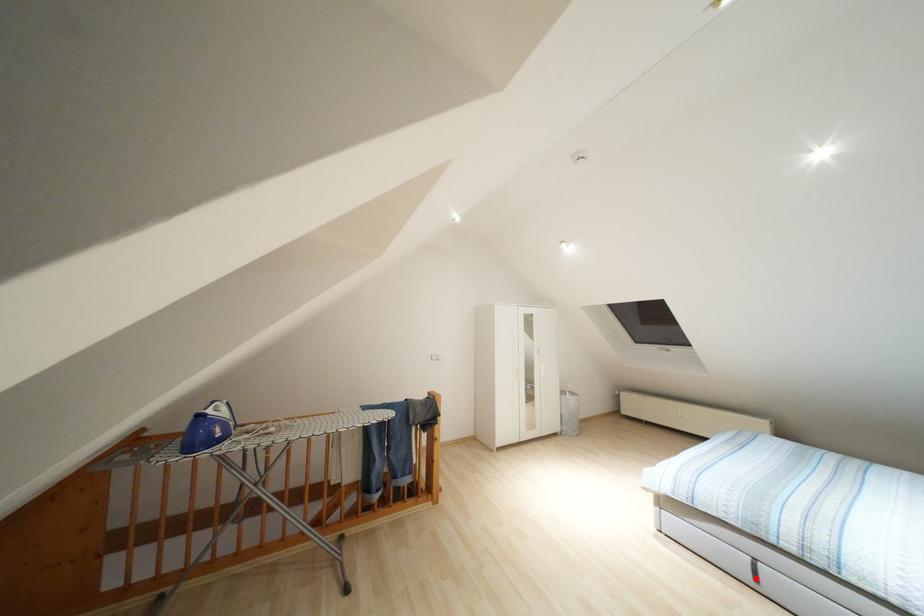
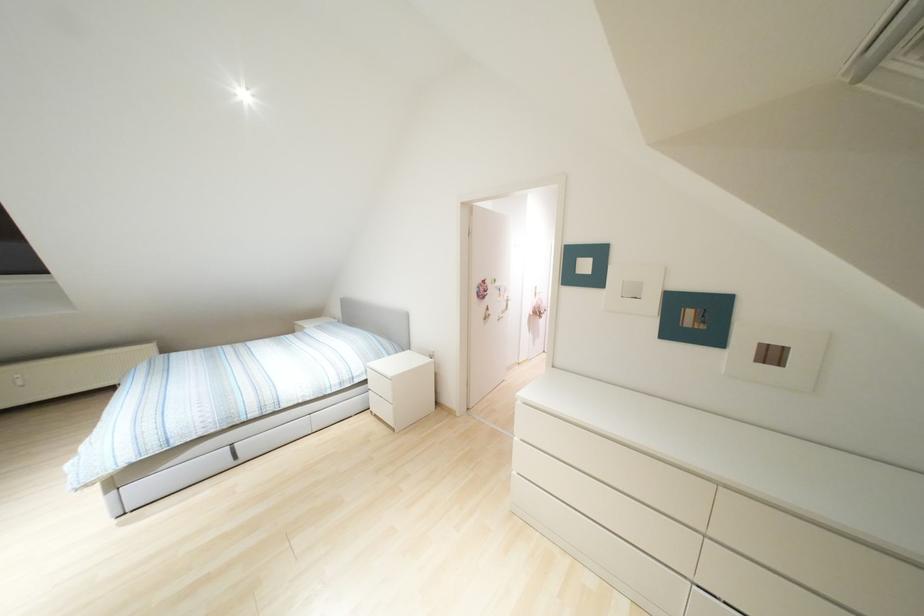
Where in the second image is the point corresponding to the highlighted location from the first image?

(235, 456)